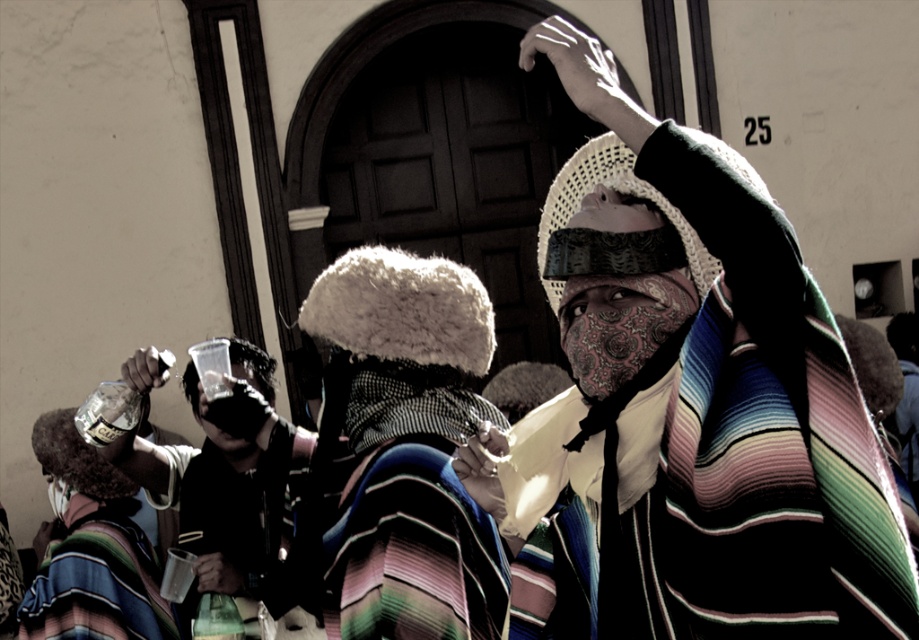
Consider the image. You are a fashion designer observing the scene. You need to create a new outfit that combines elements from both the striped woolen shawl at center and the striped woolen robe at center. Considering their distance apart, can you estimate if the combined length of both items would be sufficient to cover a standard mannequin that requires 2 meters of fabric?

The striped woolen shawl at center and striped woolen robe at center are 1.38 meters apart from each other. However, the distance between them does not indicate their individual lengths. Without knowing the specific lengths of each item, it is impossible to determine if their combined length would reach 2 meters. Additional measurements are needed.

You are a fashion designer analyzing the clothing items in the image. Which of the two items, the striped woolen shawl at center or the striped woolen robe at center, has a narrower width?

The striped woolen shawl at center is thinner than the striped woolen robe at center, so the striped woolen shawl at center has a narrower width.

Based on the scene described, which object is wider when comparing the striped woolen shawl at upper right and the matte black face at center?

The striped woolen shawl at upper right is wider than the matte black face at center.